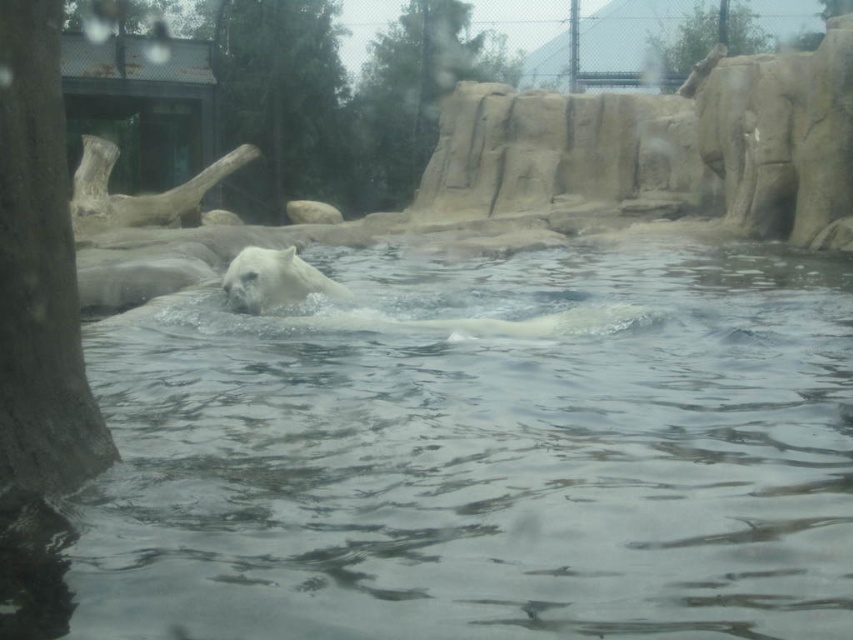
Consider the image. Does green textured rock at upper center have a smaller size compared to green leafy tree at upper center?

Actually, green textured rock at upper center might be larger than green leafy tree at upper center.

In order to click on green textured rock at upper center in this screenshot , I will do `click(412, 96)`.

Is clear water at center shorter than smooth bark tree at left?

Yes, clear water at center is shorter than smooth bark tree at left.

Measure the distance between clear water at center and smooth bark tree at left.

5.85 feet

The image size is (853, 640). I want to click on clear water at center, so click(x=473, y=458).

Is clear water at center further to the viewer compared to white fur bear at center?

That is False.

What do you see at coordinates (473, 458) in the screenshot? The image size is (853, 640). I see `clear water at center` at bounding box center [473, 458].

Image resolution: width=853 pixels, height=640 pixels. What do you see at coordinates (473, 458) in the screenshot?
I see `clear water at center` at bounding box center [473, 458].

Find the location of a particular element. This screenshot has height=640, width=853. clear water at center is located at coordinates (473, 458).